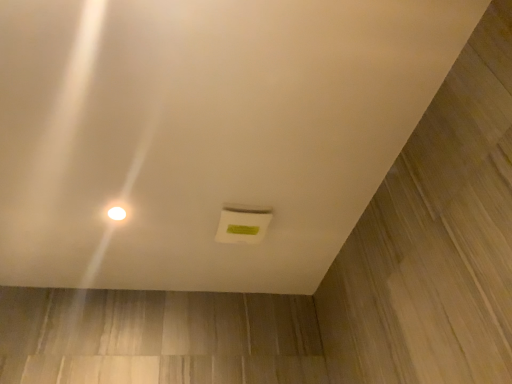
Find the location of a particular element. This screenshot has height=384, width=512. unoccupied area in front of white glossy light bulb at upper left is located at coordinates (93, 175).